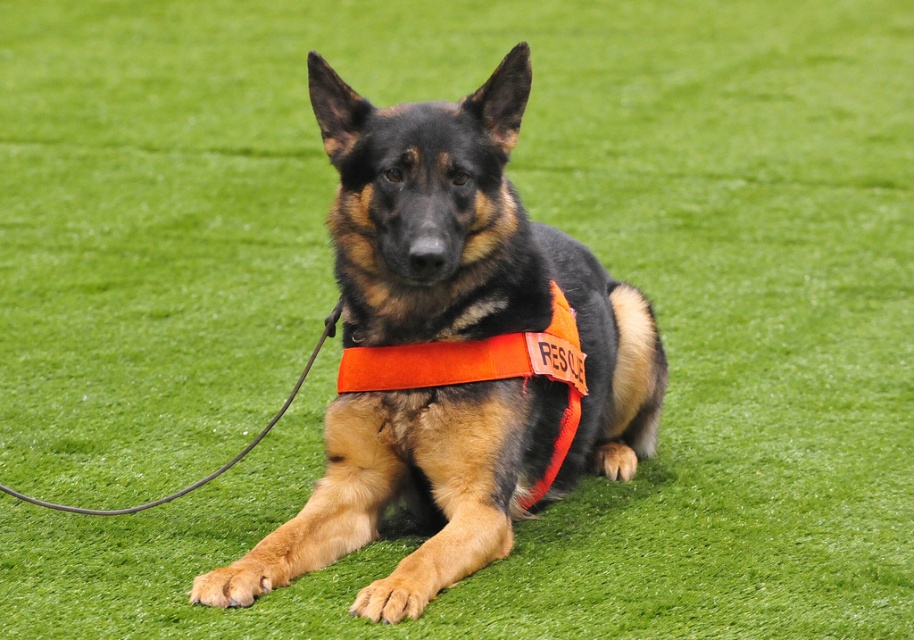
Between orange fabric vest at center and orange fabric neckband at center, which one is positioned lower?

orange fabric neckband at center

Can you confirm if orange fabric vest at center is positioned above orange fabric neckband at center?

Correct, orange fabric vest at center is located above orange fabric neckband at center.

Is point (377, 230) positioned behind point (341, 378)?

No, it is in front of (341, 378).

Where is `orange fabric vest at center`? The width and height of the screenshot is (914, 640). orange fabric vest at center is located at coordinates (454, 349).